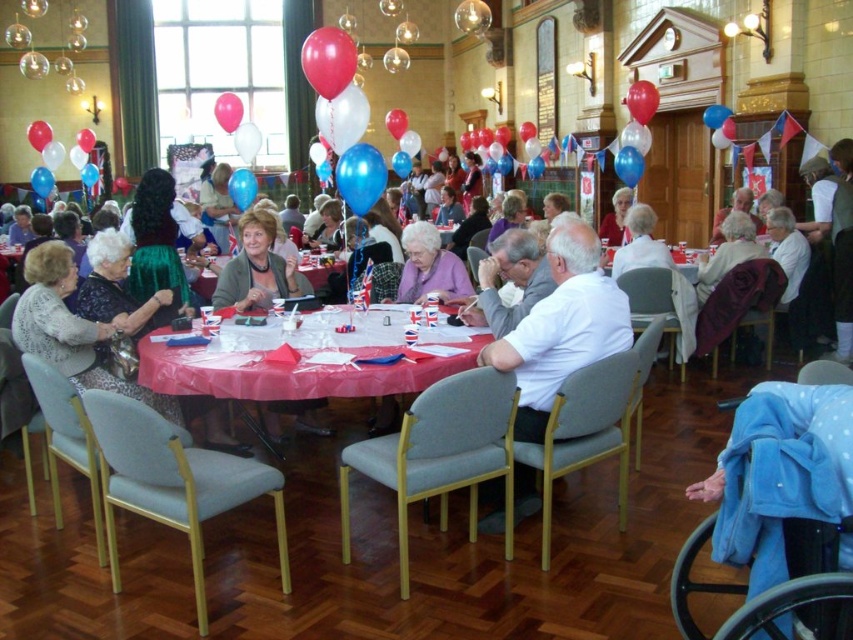
Question: Estimate the real-world distances between objects in this image. Which object is closer to the rubberized pink balloon at upper left?

Choices:
 (A) white fabric chair at center
 (B) blue glossy balloon at center
 (C) white shirt at center
 (D) red glossy balloon at upper left

Answer: (B)

Question: Which of the following is the farthest from the observer?

Choices:
 (A) white cotton shirt at center
 (B) blue fabric wheelchair at lower right
 (C) blue glossy balloon at center

Answer: (C)

Question: Which of the following is the closest to the observer?

Choices:
 (A) shiny red balloon at upper right
 (B) white shirt at center

Answer: (B)

Question: Does white shirt at center have a lesser width compared to glossy blue balloon at upper center?

Choices:
 (A) no
 (B) yes

Answer: (A)

Question: Is the position of white cotton shirt at center less distant than that of purple fabric at center?

Choices:
 (A) yes
 (B) no

Answer: (A)

Question: Can you confirm if matte gray sweater at center is wider than rubberized white balloon at center?

Choices:
 (A) no
 (B) yes

Answer: (A)